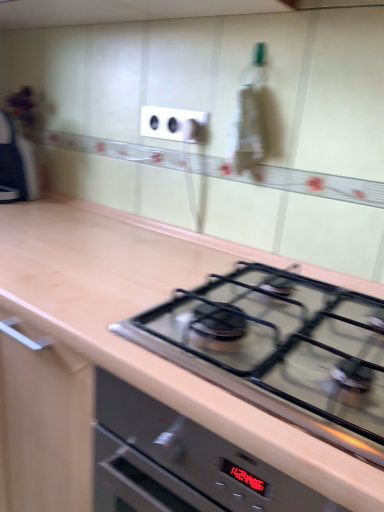
Measure the distance between matte black knob at upper center and camera.

The depth of matte black knob at upper center is 1.17 meters.

I want to click on matte black knob at upper center, so click(192, 131).

Does matte black knob at upper center turn towards white plastic electrical outlet at upper center?

Yes, matte black knob at upper center is aimed at white plastic electrical outlet at upper center.

Would you say white plastic electrical outlet at upper center is part of matte black knob at upper center's contents?

No, white plastic electrical outlet at upper center is located outside of matte black knob at upper center.

Is matte black knob at upper center with white plastic electrical outlet at upper center?

Indeed, matte black knob at upper center and white plastic electrical outlet at upper center are beside each other and touching.

From a real-world perspective, which object stands above the other?

white plastic electrical outlet at upper center is physically above.

Is white plastic electrical outlet at upper center beside matte black knob at upper center?

Yes, white plastic electrical outlet at upper center is right next to matte black knob at upper center and making contact.

Which of these two, white plastic electrical outlet at upper center or matte black knob at upper center, is smaller?

matte black knob at upper center is smaller.

Does point (151, 123) lie behind point (356, 334)?

Yes, point (151, 123) is behind point (356, 334).

Is white plastic electrical outlet at upper center facing away from satin black gas stove at center?

No, satin black gas stove at center is not at the back of white plastic electrical outlet at upper center.

Where is `electric outlet on the left of satin black gas stove at center`? The width and height of the screenshot is (384, 512). electric outlet on the left of satin black gas stove at center is located at coordinates (174, 124).

Is matte black knob at upper center not within satin black gas stove at center?

matte black knob at upper center lies outside satin black gas stove at center's area.

Locate an element on the screen. The width and height of the screenshot is (384, 512). knob located above the satin black gas stove at center (from the image's perspective) is located at coordinates (192, 131).

Considering the sizes of objects matte black knob at upper center and satin black gas stove at center in the image provided, who is bigger, matte black knob at upper center or satin black gas stove at center?

Bigger between the two is satin black gas stove at center.

Which is farther from the camera, (194, 138) or (281, 290)?

The point (194, 138) is behind.

Which of these two, satin black gas stove at center or matte black knob at upper center, stands taller?

matte black knob at upper center.

Is satin black gas stove at center far from matte black knob at upper center?

No.

Between satin black gas stove at center and matte black knob at upper center, which one has larger width?

Wider between the two is satin black gas stove at center.

Which is behind, point (247, 380) or point (184, 128)?

The point (184, 128) is more distant.

Are satin black gas stove at center and white plastic electrical outlet at upper center far apart?

No, there isn't a large distance between satin black gas stove at center and white plastic electrical outlet at upper center.

From a real-world perspective, which object rests below the other?

In real-world perspective, satin black gas stove at center is lower.

Where is `electric outlet lying above the satin black gas stove at center (from the image's perspective)`? The width and height of the screenshot is (384, 512). electric outlet lying above the satin black gas stove at center (from the image's perspective) is located at coordinates (174, 124).

Considering the sizes of objects satin black gas stove at center and white plastic electrical outlet at upper center in the image provided, who is smaller, satin black gas stove at center or white plastic electrical outlet at upper center?

white plastic electrical outlet at upper center.

Identify the location of electric outlet above the matte black knob at upper center (from a real-world perspective). This screenshot has height=512, width=384. (174, 124).

At what (x,y) coordinates should I click in order to perform the action: click on electric outlet above the matte black knob at upper center (from the image's perspective). Please return your answer as a coordinate pair (x, y). The width and height of the screenshot is (384, 512). Looking at the image, I should click on (174, 124).

Estimate the real-world distances between objects in this image. Which object is further from satin black gas stove at center, matte black knob at upper center or white plastic electrical outlet at upper center?

matte black knob at upper center is positioned further to the anchor satin black gas stove at center.

Looking at the image, which one is located closer to matte black knob at upper center, satin black gas stove at center or white plastic electrical outlet at upper center?

white plastic electrical outlet at upper center is positioned closer to the anchor matte black knob at upper center.

Consider the image. Which object lies further to the anchor point white plastic electrical outlet at upper center, matte black knob at upper center or satin black gas stove at center?

The object further to white plastic electrical outlet at upper center is satin black gas stove at center.

Estimate the real-world distances between objects in this image. Which object is further from white plastic electrical outlet at upper center, satin black gas stove at center or matte black knob at upper center?

satin black gas stove at center is positioned further to the anchor white plastic electrical outlet at upper center.

Estimate the real-world distances between objects in this image. Which object is closer to satin black gas stove at center, white plastic electrical outlet at upper center or matte black knob at upper center?

white plastic electrical outlet at upper center.

When comparing their distances from matte black knob at upper center, does white plastic electrical outlet at upper center or satin black gas stove at center seem further?

satin black gas stove at center is positioned further to the anchor matte black knob at upper center.

This screenshot has width=384, height=512. Find the location of `electric outlet between satin black gas stove at center and matte black knob at upper center from front to back`. electric outlet between satin black gas stove at center and matte black knob at upper center from front to back is located at coordinates (174, 124).